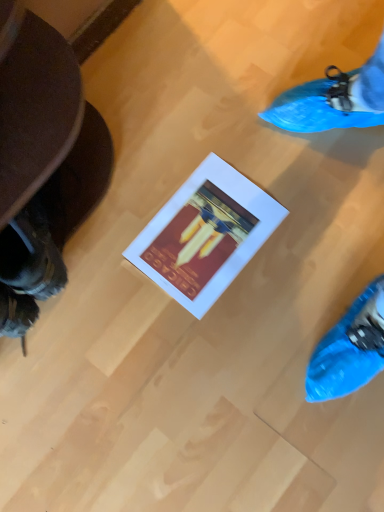
The image size is (384, 512). What are the coordinates of `vacant space in front of white matte picture frame at center` in the screenshot? It's located at (241, 336).